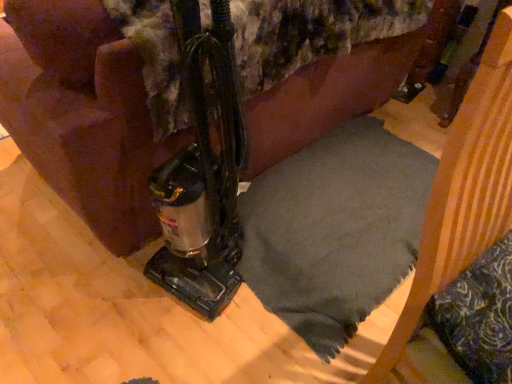
Question: Is velvety green pillow at lower right inside or outside of dark gray fabric cushion at center?

Choices:
 (A) inside
 (B) outside

Answer: (A)

Question: From the image's perspective, is velvety green pillow at lower right located above or below dark gray fabric cushion at center?

Choices:
 (A) above
 (B) below

Answer: (B)

Question: From a real-world perspective, is velvety green pillow at lower right physically located above or below dark gray fabric cushion at center?

Choices:
 (A) below
 (B) above

Answer: (A)

Question: Is dark gray fabric cushion at center spatially inside velvety green pillow at lower right, or outside of it?

Choices:
 (A) inside
 (B) outside

Answer: (B)

Question: Is point (482, 150) closer or farther from the camera than point (458, 302)?

Choices:
 (A) farther
 (B) closer

Answer: (B)

Question: From a real-world perspective, is dark gray fabric cushion at center above or below velvety green pillow at lower right?

Choices:
 (A) above
 (B) below

Answer: (A)

Question: From the image's perspective, relative to velvety green pillow at lower right, is dark gray fabric cushion at center above or below?

Choices:
 (A) above
 (B) below

Answer: (A)